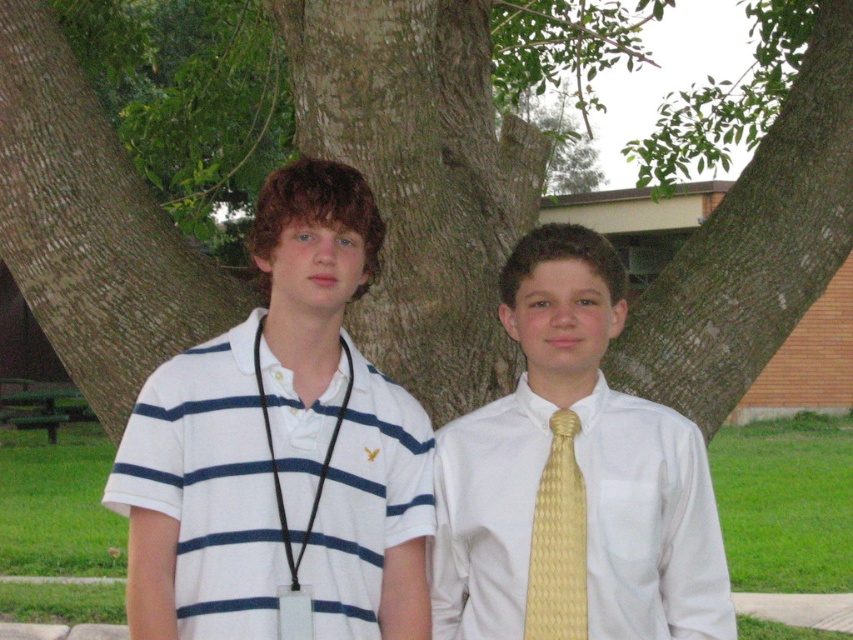
Which is more to the right, green bark tree at center or white striped polo shirt at left?

Positioned to the right is green bark tree at center.

Measure the distance between green bark tree at center and white striped polo shirt at left.

The distance of green bark tree at center from white striped polo shirt at left is 1.07 meters.

You are a GUI agent. You are given a task and a screenshot of the screen. Output one action in this format:
    pyautogui.click(x=<x>, y=<y>)
    Task: Click on the green bark tree at center
    This screenshot has width=853, height=640.
    Given the screenshot: What is the action you would take?
    pyautogui.click(x=421, y=179)

Can you confirm if white satin shirt at center is positioned below yellow textured tie at center?

Correct, white satin shirt at center is located below yellow textured tie at center.

Can you confirm if white satin shirt at center is thinner than yellow textured tie at center?

No, white satin shirt at center is not thinner than yellow textured tie at center.

Locate an element on the screen. Image resolution: width=853 pixels, height=640 pixels. white satin shirt at center is located at coordinates (648, 524).

Identify the location of green bark tree at center. This screenshot has height=640, width=853. (421, 179).

Is point (776, 148) closer to camera compared to point (521, 624)?

No, it is behind (521, 624).

Find the location of a particular element. Image resolution: width=853 pixels, height=640 pixels. green bark tree at center is located at coordinates (421, 179).